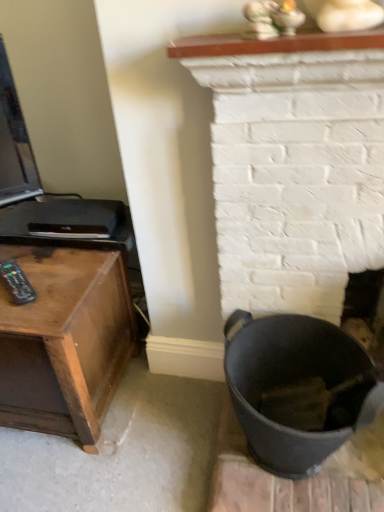
Locate an element on the screen. Image resolution: width=384 pixels, height=512 pixels. blank space situated above white brick fireplace at center (from a real-world perspective) is located at coordinates (306, 114).